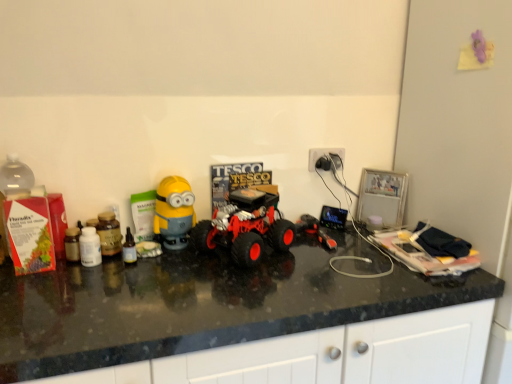
I want to click on free spot in front of yellow matte minion toy at center-left, arranged as the third toy when viewed from the right, so click(x=169, y=272).